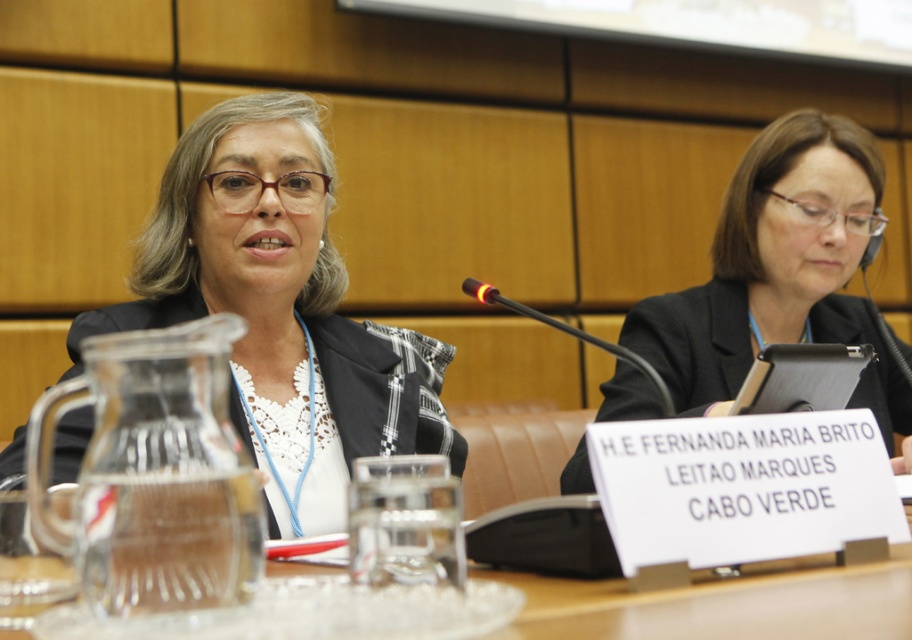
Does clear glass pitcher at left have a larger size compared to clear glass water at center?

No.

Which is in front, point (86, 468) or point (786, 608)?

Point (86, 468)

Who is more forward, (140,506) or (627,608)?

Point (140,506) is in front.

The height and width of the screenshot is (640, 912). I want to click on clear glass pitcher at left, so pyautogui.click(x=154, y=474).

Is matte black jacket at center closer to the viewer compared to clear glass water at center?

That is False.

This screenshot has width=912, height=640. What do you see at coordinates (280, 308) in the screenshot?
I see `matte black jacket at center` at bounding box center [280, 308].

Find the location of a particular element. matte black jacket at center is located at coordinates (280, 308).

Is clear glass pitcher at left to the left of black plastic microphone at center from the viewer's perspective?

Indeed, clear glass pitcher at left is positioned on the left side of black plastic microphone at center.

Identify the location of clear glass pitcher at left. [154, 474].